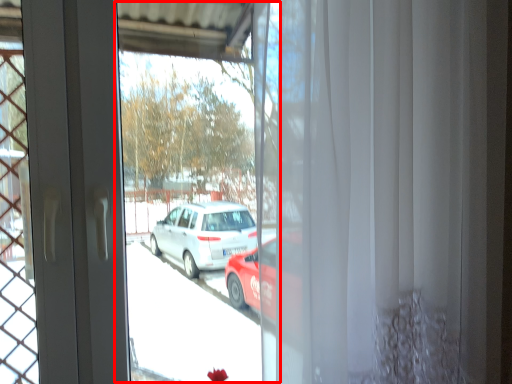
Question: Where is shop window (annotated by the red box) located in relation to curtain in the image?

Choices:
 (A) right
 (B) left

Answer: (B)